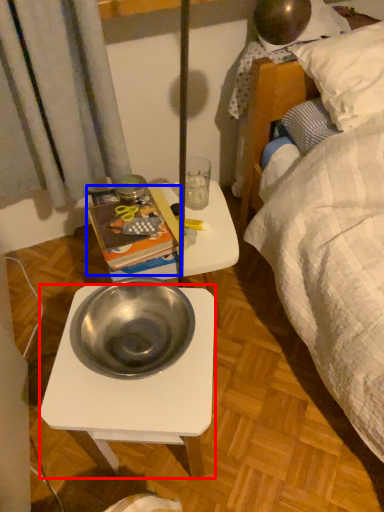
Question: Which object appears farthest to the camera in this image, desk (highlighted by a red box) or paperback book (highlighted by a blue box)?

Choices:
 (A) desk
 (B) paperback book

Answer: (B)